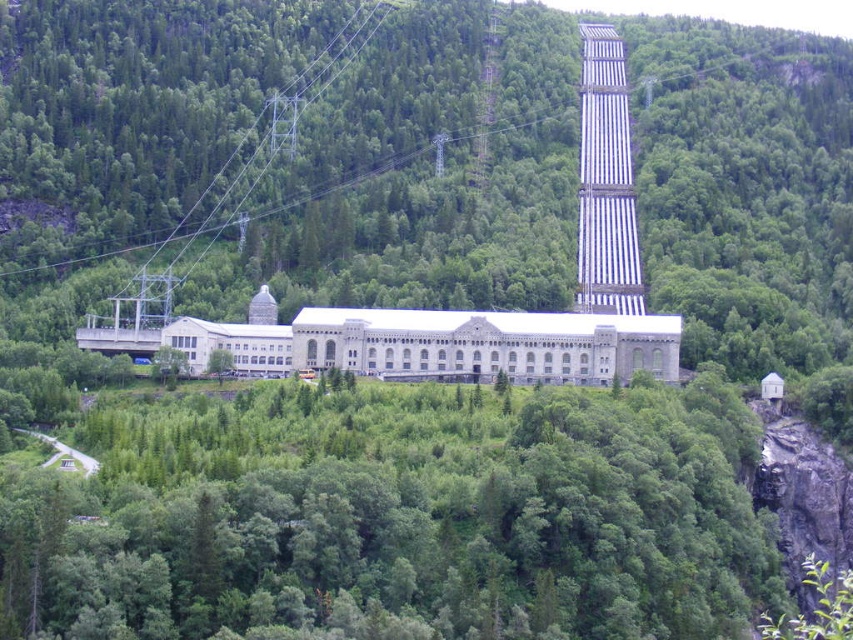
This screenshot has width=853, height=640. Describe the element at coordinates (605, 180) in the screenshot. I see `metallic grid tower at center` at that location.

Who is higher up, metallic grid tower at center or green leafy tree at center?

metallic grid tower at center is higher up.

Who is more forward, (592, 77) or (224, 372)?

Point (224, 372) is in front.

Find the location of a particular element. This screenshot has height=640, width=853. metallic grid tower at center is located at coordinates (605, 180).

Can you confirm if green leafy trees at center is shorter than metallic grid tower at center?

Indeed, green leafy trees at center has a lesser height compared to metallic grid tower at center.

Does green leafy trees at center appear on the right side of metallic grid tower at center?

No, green leafy trees at center is not to the right of metallic grid tower at center.

Which is behind, point (216, 460) or point (587, 205)?

The point (587, 205) is more distant.

Identify the location of green leafy trees at center. (402, 516).

Does point (412, 611) lie behind point (231, 368)?

No, it is not.

Is green leafy trees at center further to camera compared to green leafy tree at center?

No, green leafy trees at center is closer to the viewer.

Is point (656, 472) less distant than point (221, 369)?

Yes, it is in front of point (221, 369).

Find the location of a particular element. green leafy trees at center is located at coordinates (402, 516).